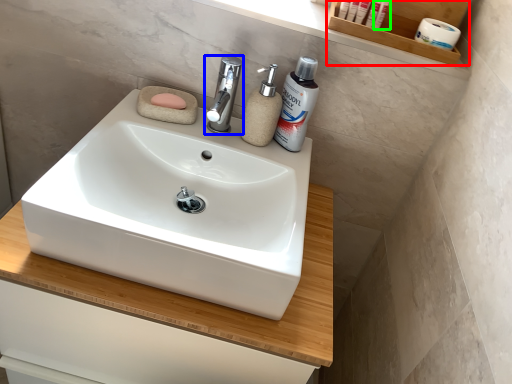
Question: Based on their relative distances, which object is farther from shelf (highlighted by a red box)? Choose from tap (highlighted by a blue box) and cosmetic (highlighted by a green box).

Choices:
 (A) tap
 (B) cosmetic

Answer: (A)